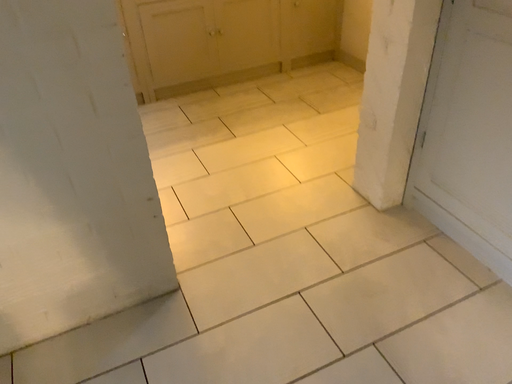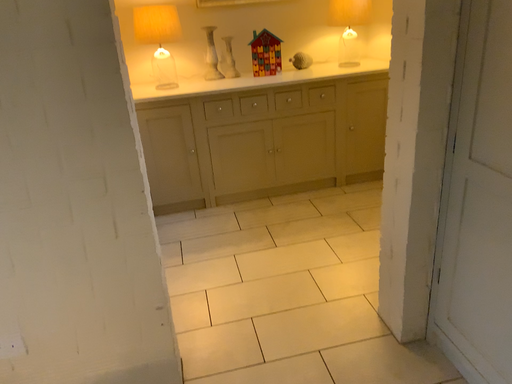
Question: Which way did the camera rotate in the video?

Choices:
 (A) rotated right
 (B) rotated left

Answer: (B)